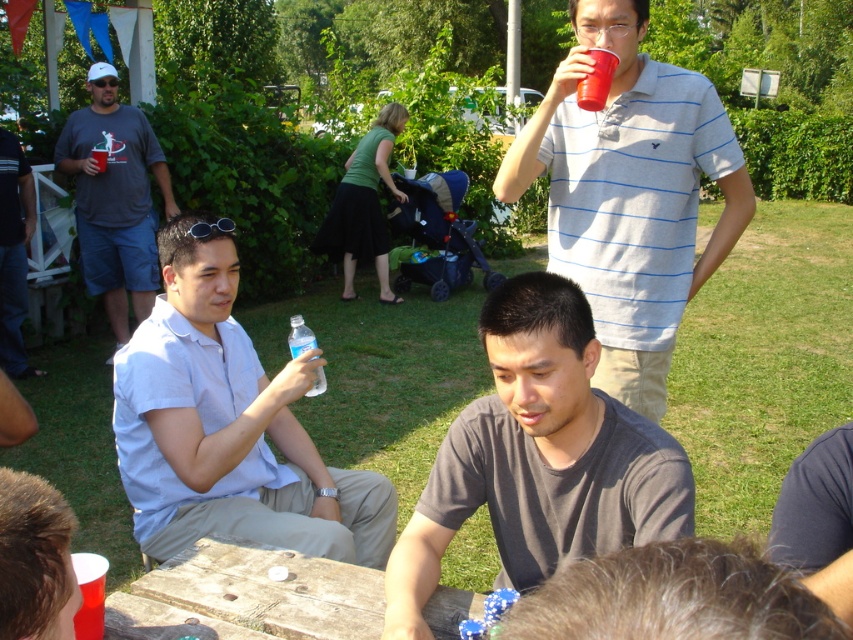
Question: Which of these objects is positioned closest to the matte gray t-shirt at left?

Choices:
 (A) matte gray shirt at left
 (B) light blue shirt at left
 (C) dark gray t-shirt at center
 (D) matte plastic cup at upper right

Answer: (A)

Question: Considering the real-world distances, which object is closest to the matte gray t-shirt at left?

Choices:
 (A) matte gray shirt at left
 (B) dark gray t-shirt at center

Answer: (A)

Question: Does dark gray t-shirt at center appear over gray striped polo shirt at upper center?

Choices:
 (A) yes
 (B) no

Answer: (B)

Question: Does gray striped polo shirt at upper center appear on the left side of clear plastic water bottle at center?

Choices:
 (A) no
 (B) yes

Answer: (A)

Question: Which point is farther to the camera?

Choices:
 (A) light blue shirt at left
 (B) matte gray shirt at left

Answer: (B)

Question: In this image, where is light blue shirt at left located relative to matte gray shirt at left?

Choices:
 (A) above
 (B) below

Answer: (B)